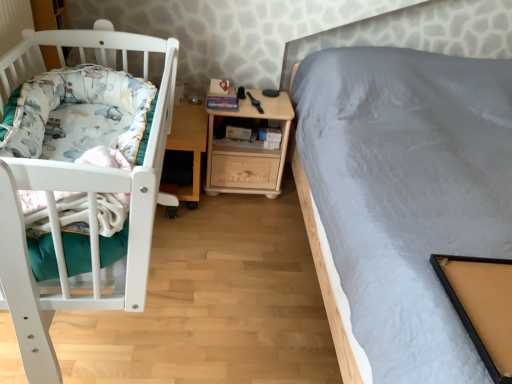
The height and width of the screenshot is (384, 512). Describe the element at coordinates (189, 141) in the screenshot. I see `wooden table at center` at that location.

Identify the location of wooden table at center. (189, 141).

Can you confirm if wooden nightstand at center is wider than wooden table at center?

In fact, wooden nightstand at center might be narrower than wooden table at center.

Is point (214, 191) positioned behind point (180, 143)?

That is True.

From a real-world perspective, which is physically above, wooden nightstand at center or wooden table at center?

From a 3D spatial view, wooden nightstand at center is above.

Is wooden nightstand at center positioned with its back to wooden table at center?

wooden nightstand at center is not turned away from wooden table at center.

Between point (199, 148) and point (241, 105), which one is positioned behind?

The point (241, 105) is farther.

Who is bigger, wooden table at center or wooden nightstand at center?

With larger size is wooden nightstand at center.

Considering the sizes of objects wooden table at center and wooden nightstand at center in the image provided, who is thinner, wooden table at center or wooden nightstand at center?

wooden nightstand at center is thinner.

Can you tell me how much wooden table at center and wooden nightstand at center differ in facing direction?

The facing directions of wooden table at center and wooden nightstand at center are 0.443 degrees apart.

Can we say white soft blanket at left lies outside wooden table at center?

Yes, white soft blanket at left is not within wooden table at center.

Where is `blanket in front of the wooden table at center`? blanket in front of the wooden table at center is located at coordinates (80, 116).

Are white soft blanket at left and wooden table at center beside each other?

No, white soft blanket at left is not beside wooden table at center.

Between point (33, 89) and point (289, 130), which one is positioned in front?

The point (33, 89) is closer.

Is white soft blanket at left situated inside wooden nightstand at center or outside?

white soft blanket at left cannot be found inside wooden nightstand at center.

Find the location of `nightstand behind the white soft blanket at left`. nightstand behind the white soft blanket at left is located at coordinates (249, 152).

From a real-world perspective, does wooden nightstand at center stand above white soft blanket at left?

Actually, wooden nightstand at center is physically below white soft blanket at left in the real world.

From the picture: What's the angular difference between wooden nightstand at center and white soft blanket at left's facing directions?

The angular difference between wooden nightstand at center and white soft blanket at left is 90.7 degrees.

The image size is (512, 384). In order to click on nightstand below the white soft blanket at left (from a real-world perspective) in this screenshot , I will do `click(249, 152)`.

Who is bigger, wooden nightstand at center or white soft blanket at left?

With larger size is white soft blanket at left.

Does wooden table at center turn towards white soft blanket at left?

Yes, wooden table at center faces towards white soft blanket at left.

Which of these two, wooden table at center or white soft blanket at left, stands taller?

With more height is wooden table at center.

Considering the sizes of objects wooden table at center and white soft blanket at left in the image provided, who is smaller, wooden table at center or white soft blanket at left?

With smaller size is wooden table at center.

In the image, is wooden table at center on the left side or the right side of white soft blanket at left?

From the image, it's evident that wooden table at center is to the right of white soft blanket at left.

The width and height of the screenshot is (512, 384). What are the coordinates of `nightstand behind the wooden table at center` in the screenshot? It's located at (249, 152).

The image size is (512, 384). In the image, there is a wooden table at center. In order to click on nightstand above it (from the image's perspective) in this screenshot , I will do `click(249, 152)`.

Considering their positions, is white soft blanket at left positioned further to wooden table at center than wooden nightstand at center?

Among the two, white soft blanket at left is located further to wooden table at center.

Based on their spatial positions, is white soft blanket at left or wooden table at center closer to wooden nightstand at center?

wooden table at center.

Estimate the real-world distances between objects in this image. Which object is further from wooden table at center, wooden nightstand at center or white soft blanket at left?

white soft blanket at left lies further to wooden table at center than the other object.

Looking at the image, which one is located closer to white soft blanket at left, wooden nightstand at center or wooden table at center?

wooden table at center lies closer to white soft blanket at left than the other object.

Consider the image. Estimate the real-world distances between objects in this image. Which object is closer to wooden nightstand at center, wooden table at center or white soft blanket at left?

wooden table at center is closer to wooden nightstand at center.

Based on their spatial positions, is wooden table at center or wooden nightstand at center further from white soft blanket at left?

wooden nightstand at center is further to white soft blanket at left.

Find the location of a particular element. Image resolution: width=512 pixels, height=384 pixels. table located between white soft blanket at left and wooden nightstand at center in the depth direction is located at coordinates coord(189,141).